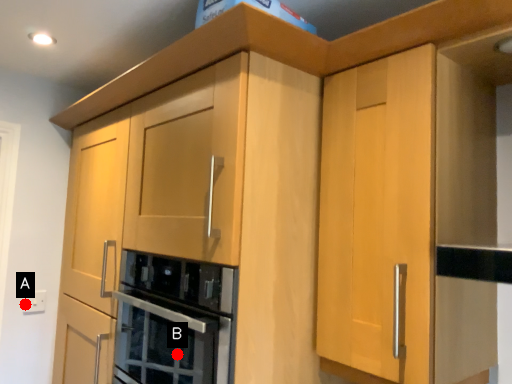
Question: Two points are circled on the image, labeled by A and B beside each circle. Which point appears closest to the camera in this image?

Choices:
 (A) A is closer
 (B) B is closer

Answer: (B)